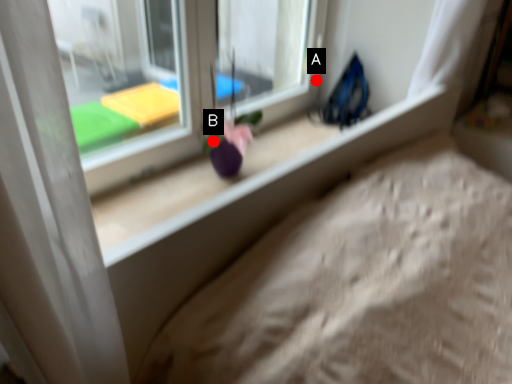
Question: Two points are circled on the image, labeled by A and B beside each circle. Which point appears closest to the camera in this image?

Choices:
 (A) A is closer
 (B) B is closer

Answer: (B)